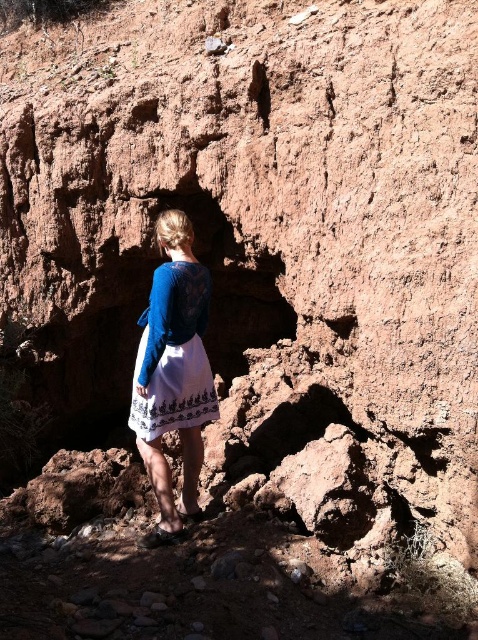
Does point (152, 460) lie behind point (206, 284)?

No, (152, 460) is closer to viewer.

Does blue lace dress at center appear under white embroidered dress at center?

Correct, blue lace dress at center is located below white embroidered dress at center.

Is point (141, 452) closer to viewer compared to point (208, 292)?

Yes, point (141, 452) is closer to viewer.

This screenshot has height=640, width=478. Find the location of `blue lace dress at center`. blue lace dress at center is located at coordinates tap(173, 372).